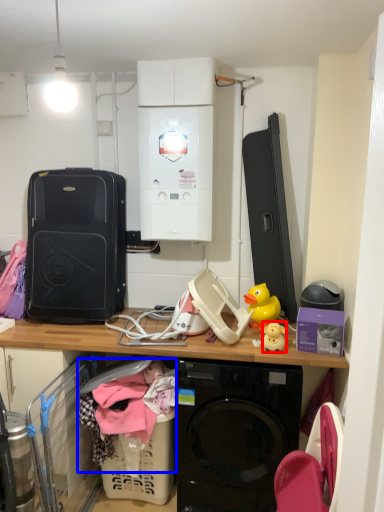
Question: Among these objects, which one is nearest to the camera, toy (highlighted by a red box) or clothing (highlighted by a blue box)?

Choices:
 (A) toy
 (B) clothing

Answer: (B)